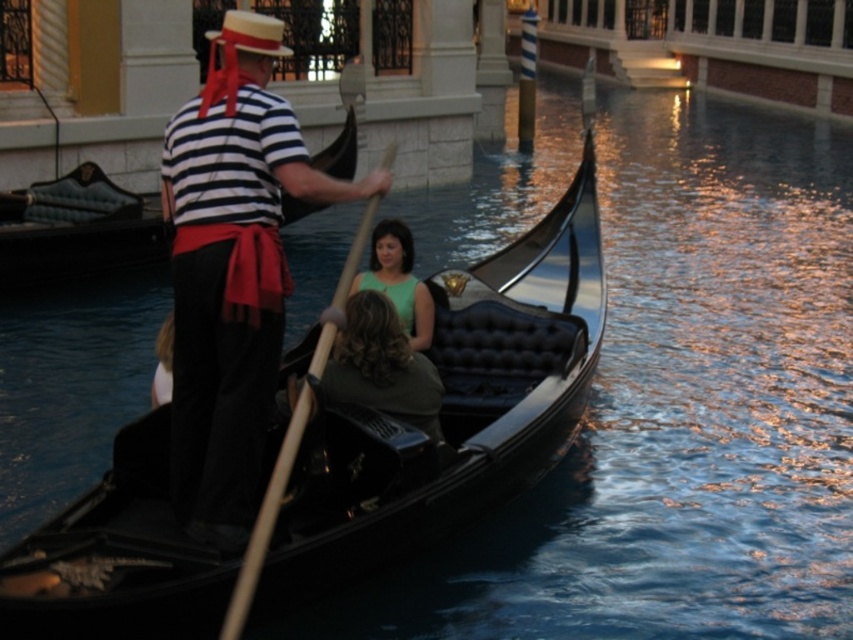
You are standing on the bank of the canal and want to determine which of the two points, point (202,113) or point (432,310), is nearer to you. Based on the scene, which point is closer?

Point (202,113) is closer to the viewer than point (432,310).

You are a tourist standing on the canal bank and want to take a photo of the black polished wood boat at center. Where should you position yourself to capture the boat in the best possible angle?

The black polished wood boat at center is located at point 0.639 on the x axis and 0.533 on the y axis, so you should position yourself directly in front of that coordinate to capture the boat in the best possible angle.

You are standing on the canal bank and see the gondolier represented by point (231,272). Where exactly is the gondolier located in the image?

The gondolier represented by point (231,272) is located at the center of the image.